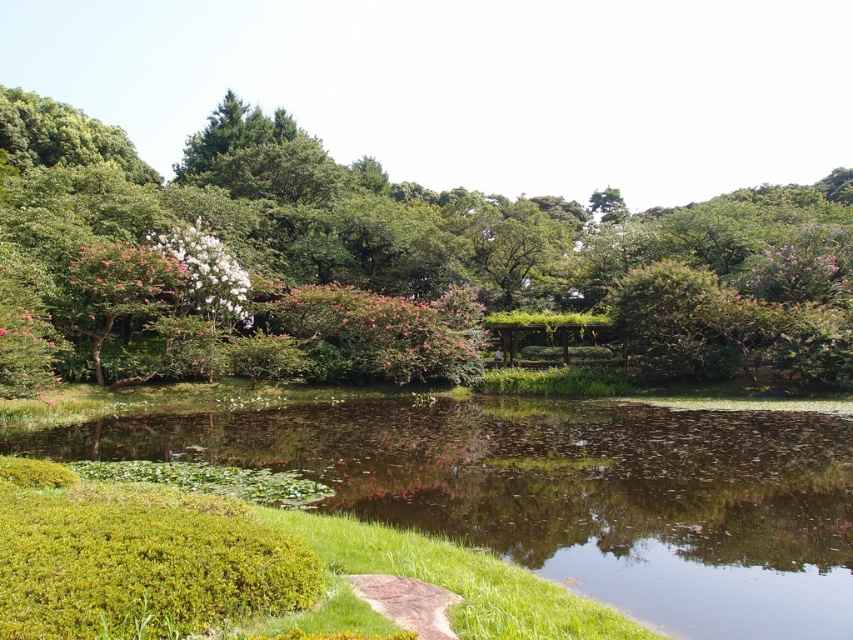
You are standing in the garden and want to take a photo of the green leafy tree at center and the green grassy lake at lower left. Which object should you focus on first if you want to capture both in a single frame without moving the camera?

You should focus on the green leafy tree at center first because it is taller than the green grassy lake at lower left, so it will occupy more space in the frame and ensure both are visible.

You are standing in the garden and want to take a photo of the point at coordinates point [184,364]. If your camera has a maximum focus range of 30 meters, will you be able to focus on it?

The point [184,364] is 32.70 meters away from the camera, which exceeds the camera maximum focus range of 30 meters. Therefore, the camera cannot focus on it.

You are a bird flying over the garden and want to land on the green grassy lake at lower left. To reach it, you must first pass between the green leafy tree at center and another object. Which object is that?

The green grassy lake at lower left is behind the green leafy tree at center, so you must pass between the green leafy tree at center and the hedge on the left side of the pond to reach it.